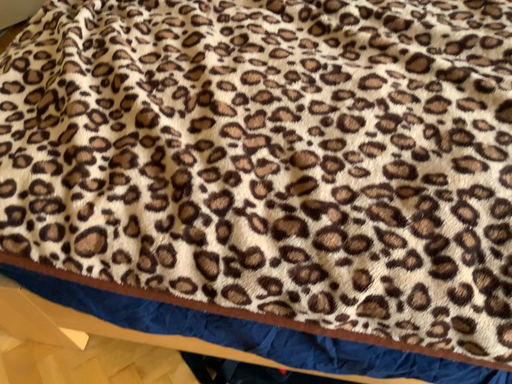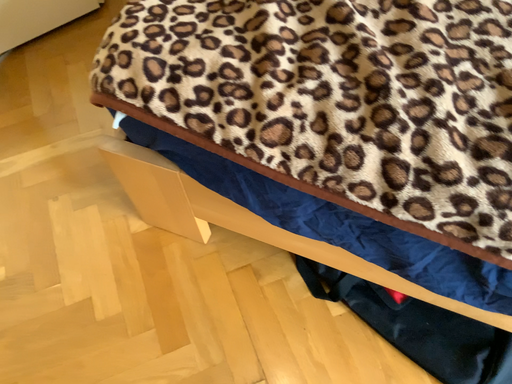
Question: How did the camera likely rotate when shooting the video?

Choices:
 (A) rotated downward
 (B) rotated upward

Answer: (A)